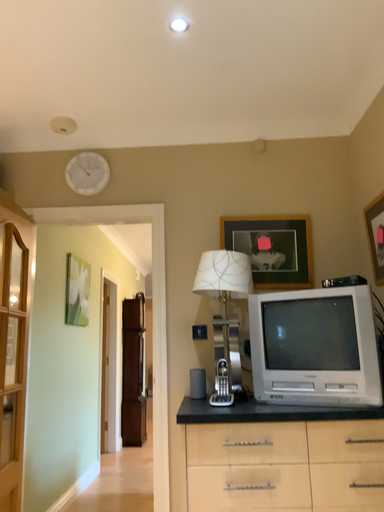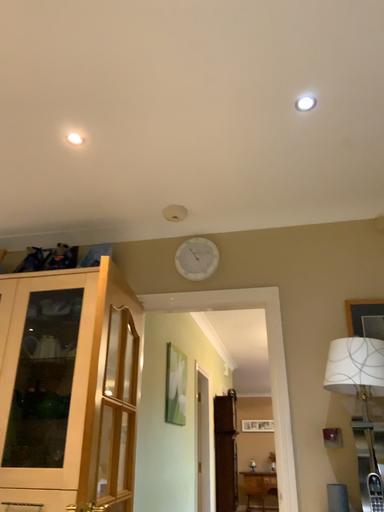
Question: Which way did the camera rotate in the video?

Choices:
 (A) rotated left
 (B) rotated right

Answer: (A)